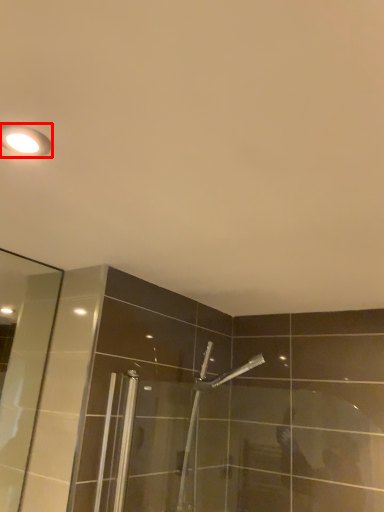
Question: From the image's perspective, considering the relative positions of light fixture (annotated by the red box) and shower in the image provided, where is light fixture (annotated by the red box) located with respect to the staircase?

Choices:
 (A) above
 (B) below

Answer: (A)